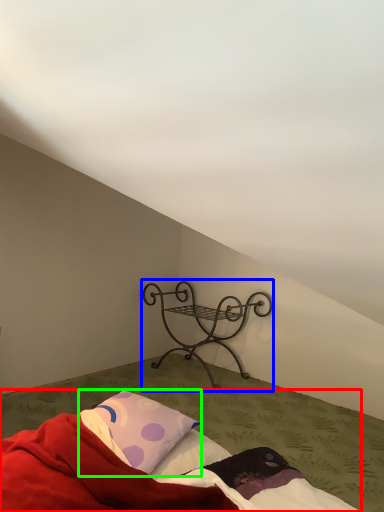
Question: Based on their relative distances, which object is farther from bed (highlighted by a red box)? Choose from furniture (highlighted by a blue box) and pillow (highlighted by a green box).

Choices:
 (A) furniture
 (B) pillow

Answer: (A)